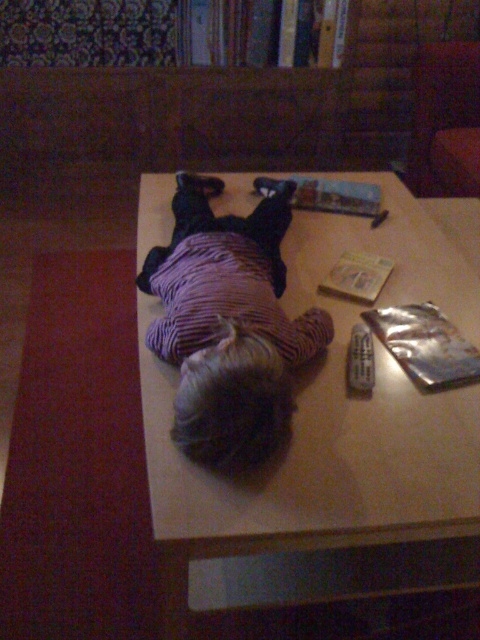
Question: Estimate the real-world distances between objects in this image. Which object is closer to the black plastic remote at center?

Choices:
 (A) purple corduroy shirt at center
 (B) wooden table at center
 (C) red carpet at lower left

Answer: (B)

Question: Which point is closer to the camera taking this photo?

Choices:
 (A) (352, 328)
 (B) (169, 552)

Answer: (B)

Question: Can you confirm if red carpet at lower left is smaller than black plastic remote at center?

Choices:
 (A) yes
 (B) no

Answer: (B)

Question: Does wooden table at center lie behind purple corduroy shirt at center?

Choices:
 (A) yes
 (B) no

Answer: (B)

Question: Observing the image, what is the correct spatial positioning of red carpet at lower left in reference to purple corduroy shirt at center?

Choices:
 (A) right
 (B) left

Answer: (B)

Question: Considering the real-world distances, which object is farthest from the black plastic remote at center?

Choices:
 (A) red carpet at lower left
 (B) purple corduroy shirt at center

Answer: (A)